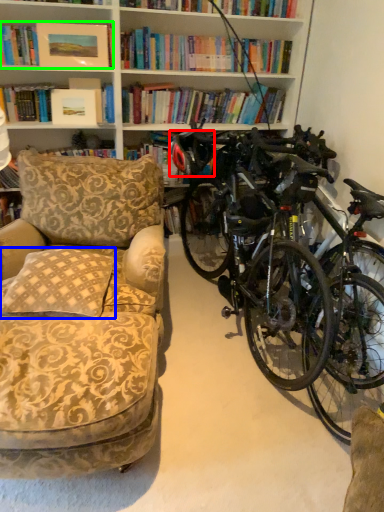
Question: Which is farther away from helmet (highlighted by a red box)? pillow (highlighted by a blue box) or book (highlighted by a green box)?

Choices:
 (A) pillow
 (B) book

Answer: (A)